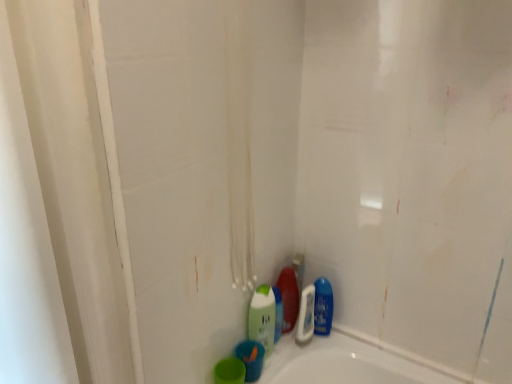
Question: Based on their sizes in the image, would you say shiny plastic bottle at lower center, the second cleaning product viewed from the right, is bigger or smaller than blue glossy bottle at lower right, which appears as the third cleaning product when viewed from the left?

Choices:
 (A) small
 (B) big

Answer: (B)

Question: Is shiny plastic bottle at lower center, which is the 2th cleaning product in left-to-right order, wider or thinner than blue glossy bottle at lower right, the 1th cleaning product viewed from the right?

Choices:
 (A) thin
 (B) wide

Answer: (B)

Question: Which of these objects is positioned closest to the green matte bottle at lower center, acting as the 1th cleaning product starting from the left?

Choices:
 (A) shiny plastic bottle at lower center, the second cleaning product viewed from the right
 (B) blue matte bottle at lower center, the second mouthwash from the left
 (C) blue glossy bottle at lower right, the 1th cleaning product viewed from the right
 (D) blue glossy mouthwash at lower right, the first mouthwash when ordered from right to left
 (E) green matte cup at lower center, which appears as the 1th mouthwash when viewed from the front

Answer: (B)

Question: Estimate the real-world distances between objects in this image. Which object is closer to the green matte cup at lower center, which appears as the 1th mouthwash when viewed from the front?

Choices:
 (A) blue glossy mouthwash at lower right, which is the 3th mouthwash from front to back
 (B) green matte bottle at lower center, marked as the 3th cleaning product in a right-to-left arrangement
 (C) blue matte bottle at lower center, which is the second mouthwash from right to left
 (D) shiny plastic bottle at lower center, which is the 2th cleaning product in left-to-right order
 (E) blue glossy bottle at lower right, the 1th cleaning product viewed from the right

Answer: (C)